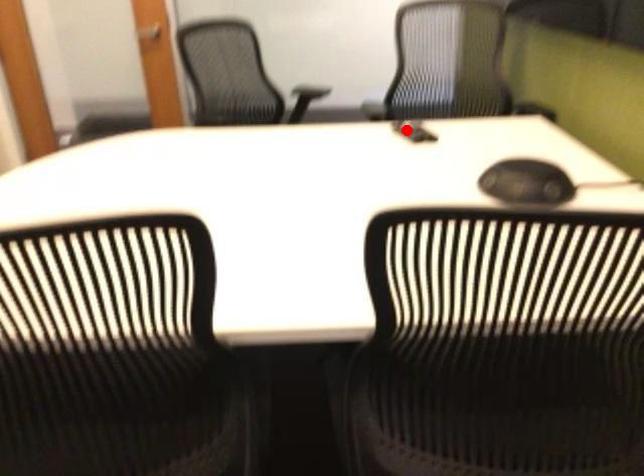
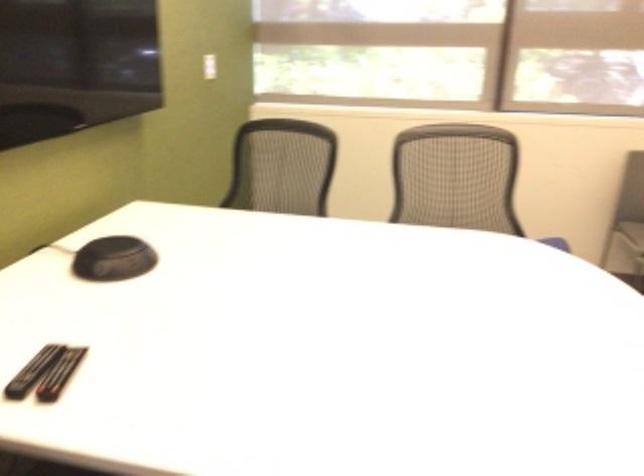
Question: I am providing you with two images of the same scene from different viewpoints. A red point is shown in image1. For the corresponding object point in image2, is it positioned nearer or farther from the camera?

Choices:
 (A) Nearer
 (B) Farther

Answer: (A)